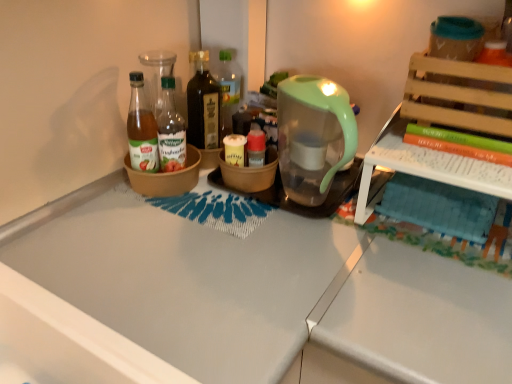
Question: From a real-world perspective, is green matte book at upper right physically located above or below dark brown glass bottle at center, placed as the 2th bottle when sorted from left to right?

Choices:
 (A) below
 (B) above

Answer: (B)

Question: Considering their positions, is green matte book at upper right located in front of or behind dark brown glass bottle at center, placed as the 2th bottle when sorted from left to right?

Choices:
 (A) front
 (B) behind

Answer: (A)

Question: Which object is the closest to the dark brown glass bottle at center, placed as the 2th bottle when sorted from left to right?

Choices:
 (A) translucent green coffeepot at upper right
 (B) green glass bottle at center, which is counted as the third bottle, starting from the right
 (C) brown ceramic bowl at center, placed as the 1th bowl when sorted from left to right
 (D) brown matte bowl at center, acting as the 2th bowl starting from the left
 (E) translucent glass bottle at center, acting as the 3th bottle starting from the left

Answer: (E)

Question: Which object is positioned closest to the green glass bottle at center, which is counted as the third bottle, starting from the right?

Choices:
 (A) brown ceramic bowl at center, placed as the 1th bowl when sorted from left to right
 (B) brown matte bowl at center, which is the 1th bowl from right to left
 (C) translucent glass bottle at center, acting as the 3th bottle starting from the left
 (D) green matte book at upper right
 (E) translucent green coffeepot at upper right

Answer: (A)